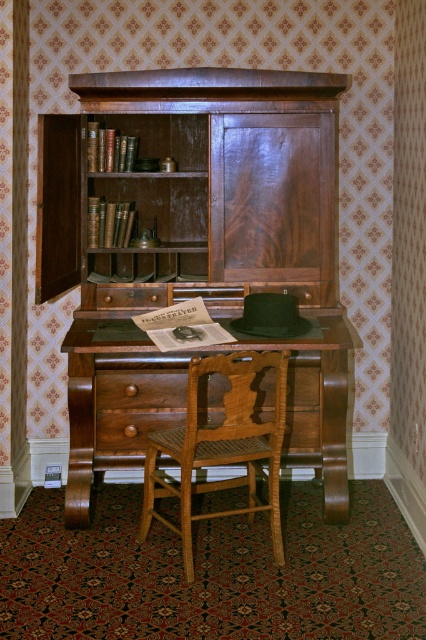
Between mahogany wood bookcase at center and wooden desk at center, which one appears on the left side from the viewer's perspective?

Positioned to the left is mahogany wood bookcase at center.

Is mahogany wood bookcase at center wider than wooden desk at center?

Yes.

This screenshot has height=640, width=426. What do you see at coordinates (196, 250) in the screenshot? I see `mahogany wood bookcase at center` at bounding box center [196, 250].

Where is `mahogany wood bookcase at center`? The width and height of the screenshot is (426, 640). mahogany wood bookcase at center is located at coordinates (196, 250).

Is mahogany wood bookcase at center further to the viewer compared to light brown wooden chair at center?

Yes.

Who is positioned more to the left, mahogany wood bookcase at center or light brown wooden chair at center?

From the viewer's perspective, mahogany wood bookcase at center appears more on the left side.

Is point (253, 227) positioned after point (207, 424)?

Yes, it is behind point (207, 424).

The image size is (426, 640). I want to click on mahogany wood bookcase at center, so click(x=196, y=250).

Does point (80, 340) lie behind point (236, 451)?

Yes, point (80, 340) is behind point (236, 451).

Looking at this image, does wooden desk at center have a smaller size compared to light brown wooden chair at center?

Actually, wooden desk at center might be larger than light brown wooden chair at center.

Describe the element at coordinates (115, 401) in the screenshot. I see `wooden desk at center` at that location.

Where is `wooden desk at center`? wooden desk at center is located at coordinates (115, 401).